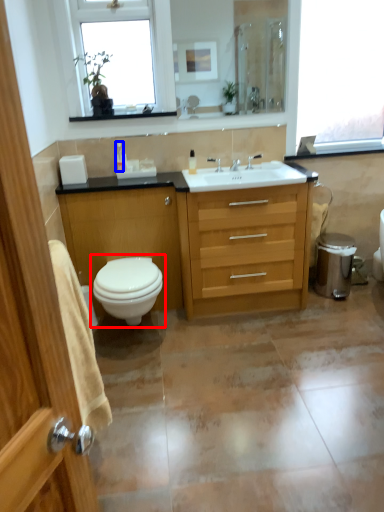
Question: Which object appears closest to the camera in this image, toilet (highlighted by a red box) or toiletry (highlighted by a blue box)?

Choices:
 (A) toilet
 (B) toiletry

Answer: (A)